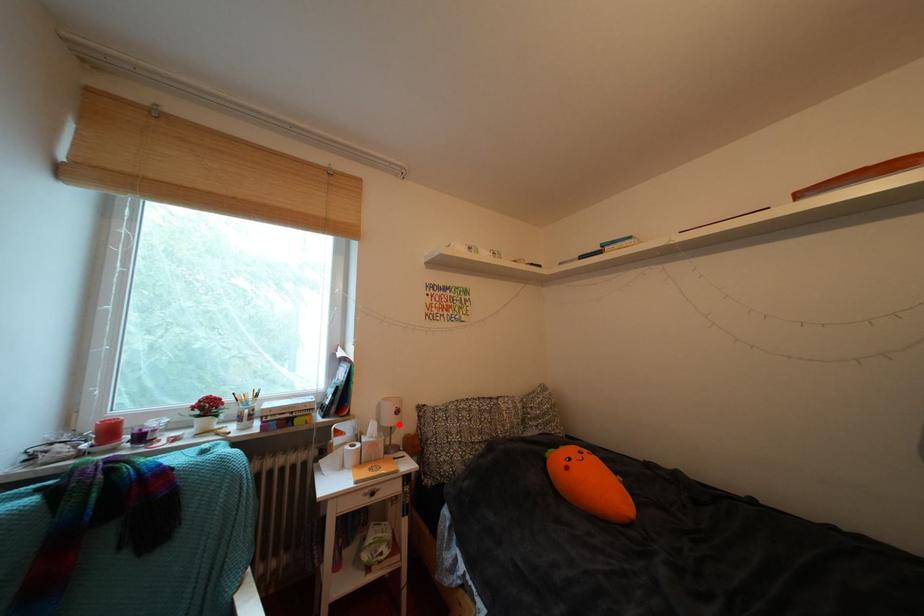
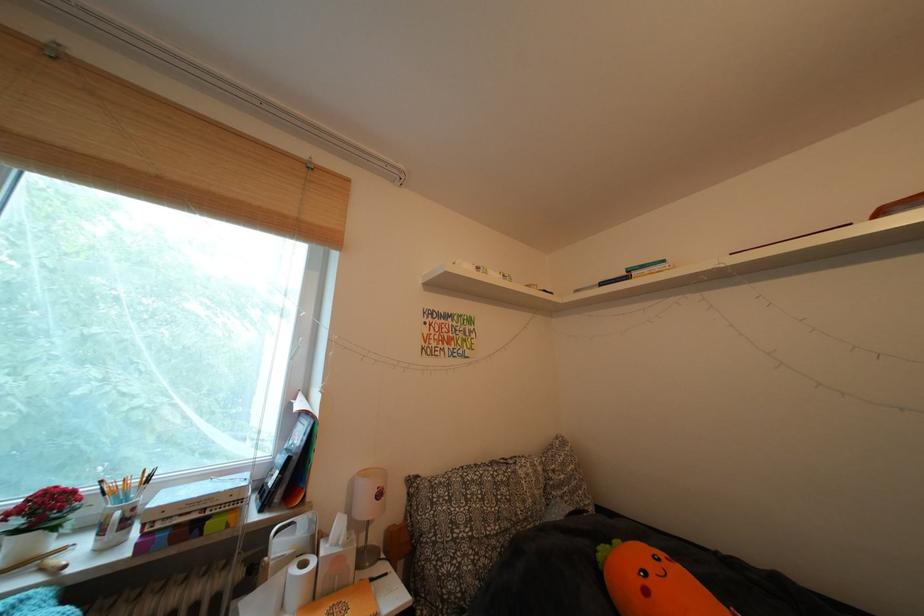
In the second image, find the point that corresponds to the highlighted location in the first image.

(375, 513)